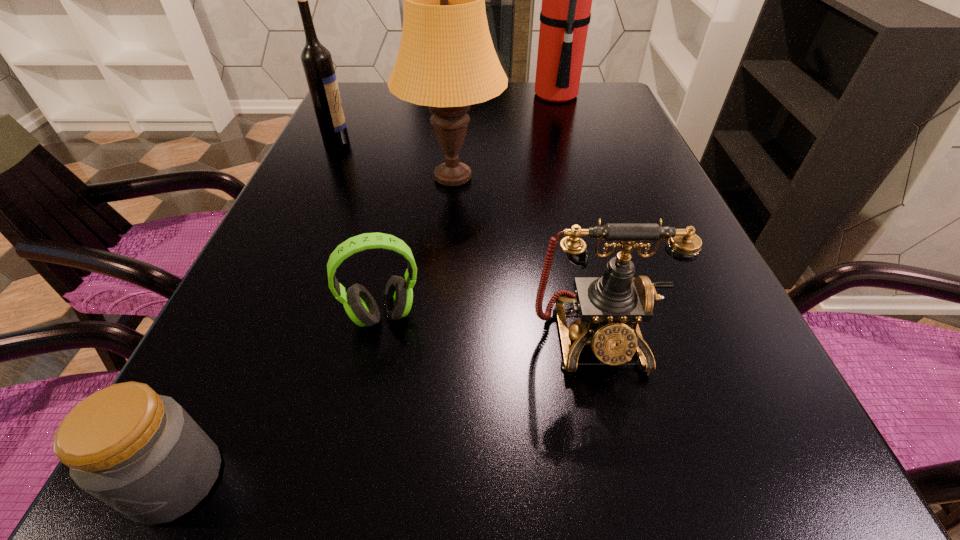
Image resolution: width=960 pixels, height=540 pixels. I want to click on object situated at the near left corner, so click(x=141, y=453).

Where is `object that is at the far right corner`? object that is at the far right corner is located at coordinates (565, 15).

You are a GUI agent. You are given a task and a screenshot of the screen. Output one action in this format:
    pyautogui.click(x=<x>, y=<y>)
    Task: Click on the free space at the far edge of the desktop
    The width and height of the screenshot is (960, 540).
    Given the screenshot: What is the action you would take?
    point(487,103)

Where is `free region at the left edge of the desktop`? This screenshot has height=540, width=960. free region at the left edge of the desktop is located at coordinates (251, 365).

I want to click on vacant area at the right edge, so click(x=677, y=380).

Find the location of a particular element. The image size is (960, 540). free point at the far right corner is located at coordinates click(x=618, y=89).

I want to click on free spot between the second farthest object and the lampshade, so click(395, 159).

You are a GUI agent. You are given a task and a screenshot of the screen. Output one action in this format:
    pyautogui.click(x=<x>, y=<y>)
    Task: Click on the free space between the lampshade and the fourth tallest object
    This screenshot has width=960, height=540.
    Given the screenshot: What is the action you would take?
    pyautogui.click(x=524, y=258)

The image size is (960, 540). I want to click on vacant area that lies between the lampshade and the headset, so click(x=418, y=247).

Locate an element on the screen. Image resolution: width=960 pixels, height=540 pixels. vacant region between the lampshade and the farthest object is located at coordinates (505, 137).